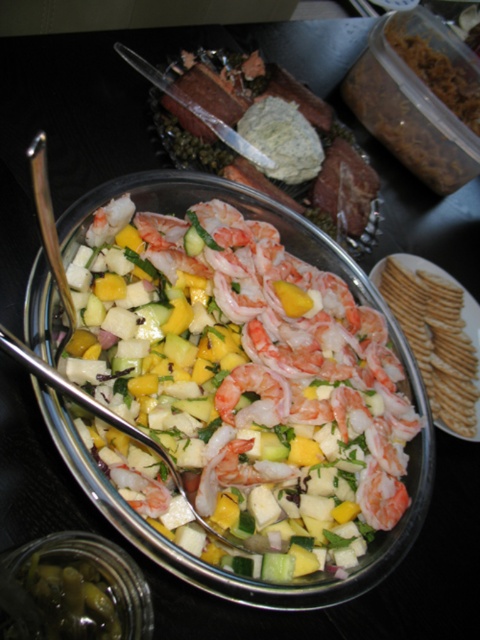
You are standing at a distance and want to reach the point marked as point [156,324] on the table. If your hand can extend 18 inches, will you be able to reach it?

The point [156,324] is 18.63 inches away from the viewer, so your hand can only extend 18 inches, which means you cannot reach it.

Where is the shiny pink shrimp at center located in the image?

The shiny pink shrimp at center is located at point 0.570 on the x axis and 0.500 on the y axis.